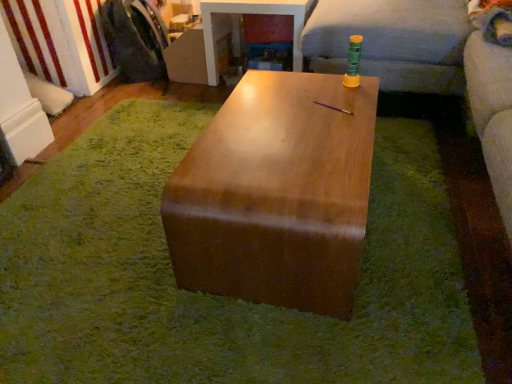
Measure the distance between point (301, 9) and camera.

The depth of point (301, 9) is 2.35 meters.

The height and width of the screenshot is (384, 512). In order to click on soft gray fabric couch at upper right in this screenshot , I will do `click(393, 42)`.

This screenshot has height=384, width=512. Describe the element at coordinates (276, 193) in the screenshot. I see `glossy wood table at center, arranged as the first table when viewed from the front` at that location.

This screenshot has height=384, width=512. Find the location of `wooden table at center`. wooden table at center is located at coordinates (213, 295).

The width and height of the screenshot is (512, 384). I want to click on glossy wood table at center, which is the 2th table from bottom to top, so click(x=252, y=13).

From a real-world perspective, is wooden table at center on glossy wood table at center, which is the 2th table from bottom to top?

No, from a real-world perspective, wooden table at center is not over glossy wood table at center, which is the 2th table from bottom to top

Which is closer, [230,305] or [290,0]?

Point [230,305] is closer to the camera than point [290,0].

Which object is more forward, wooden table at center or glossy wood table at center, which is the 1th table in back-to-front order?

Positioned in front is wooden table at center.

Can you tell me how much wooden table at center and glossy wood table at center, which is the 1th table in back-to-front order, differ in facing direction?

The angular difference between wooden table at center and glossy wood table at center, which is the 1th table in back-to-front order, is 1.66 degrees.

Between glossy wood table at center, which appears as the 1th table when ordered from the bottom, and wooden table at center, which one has more height?

glossy wood table at center, which appears as the 1th table when ordered from the bottom.

Which is behind, point (183, 175) or point (294, 332)?

Positioned behind is point (294, 332).

From a real-world perspective, is glossy wood table at center, arranged as the first table when viewed from the front, physically above wooden table at center?

Indeed, from a real-world perspective, glossy wood table at center, arranged as the first table when viewed from the front, stands above wooden table at center.

In the scene shown: Is soft gray fabric couch at upper right facing away from wooden table at center?

No, wooden table at center is not at the back of soft gray fabric couch at upper right.

From the image's perspective, would you say soft gray fabric couch at upper right is positioned over wooden table at center?

Correct, soft gray fabric couch at upper right appears higher than wooden table at center in the image.

Who is shorter, soft gray fabric couch at upper right or wooden table at center?

wooden table at center is shorter.

Which is more to the right, glossy wood table at center, which is the 2th table from bottom to top, or glossy wood table at center, arranged as the first table when viewed from the front?

From the viewer's perspective, glossy wood table at center, arranged as the first table when viewed from the front, appears more on the right side.

Which is closer, (233, 13) or (228, 236)?

Clearly, point (233, 13) is more distant from the camera than point (228, 236).

Which is correct: glossy wood table at center, which is the 1th table in back-to-front order, is inside glossy wood table at center, the 2th table when ordered from top to bottom, or outside of it?

glossy wood table at center, which is the 1th table in back-to-front order, is not enclosed by glossy wood table at center, the 2th table when ordered from top to bottom.

Considering the sizes of glossy wood table at center, which is the 2th table from bottom to top, and glossy wood table at center, which appears as the 1th table when ordered from the bottom, in the image, is glossy wood table at center, which is the 2th table from bottom to top, bigger or smaller than glossy wood table at center, which appears as the 1th table when ordered from the bottom,?

Clearly, glossy wood table at center, which is the 2th table from bottom to top, is smaller in size than glossy wood table at center, which appears as the 1th table when ordered from the bottom.

Does glossy wood table at center, the 2th table when ordered from top to bottom, turn towards glossy wood table at center, which is the 1th table in back-to-front order?

No, glossy wood table at center, the 2th table when ordered from top to bottom, is not oriented towards glossy wood table at center, which is the 1th table in back-to-front order.

Locate an element on the screen. table that is in front of the glossy wood table at center, which is the 2th table from bottom to top is located at coordinates (276, 193).

From a real-world perspective, does glossy wood table at center, which appears as the 1th table when ordered from the bottom, sit lower than glossy wood table at center, which is the 1th table in back-to-front order?

Yes, from a real-world perspective, glossy wood table at center, which appears as the 1th table when ordered from the bottom, is below glossy wood table at center, which is the 1th table in back-to-front order.

From the image's perspective, relative to glossy wood table at center, arranged as the 2th table when viewed from the front, is glossy wood table at center, the second table viewed from the back, above or below?

glossy wood table at center, the second table viewed from the back, is below glossy wood table at center, arranged as the 2th table when viewed from the front.

Is brushed metal washing machine at left positioned with its back to soft gray fabric couch at upper right?

No, brushed metal washing machine at left is not facing the opposite direction of soft gray fabric couch at upper right.

Is there a large distance between brushed metal washing machine at left and soft gray fabric couch at upper right?

brushed metal washing machine at left is far away from soft gray fabric couch at upper right.

You are a GUI agent. You are given a task and a screenshot of the screen. Output one action in this format:
    pyautogui.click(x=<x>, y=<y>)
    Task: Click on the couple above the soft gray fabric couch at upper right (from the image's perspective)
    This screenshot has height=384, width=512.
    Given the screenshot: What is the action you would take?
    pyautogui.click(x=135, y=38)

How different are the orientations of brushed metal washing machine at left and soft gray fabric couch at upper right in degrees?

There is a 180-degree angle between the facing directions of brushed metal washing machine at left and soft gray fabric couch at upper right.

Measure the distance from soft gray fabric couch at upper right to glossy wood table at center, the first table viewed from the top.

soft gray fabric couch at upper right and glossy wood table at center, the first table viewed from the top, are 16.94 inches apart.

From a real-world perspective, is soft gray fabric couch at upper right physically located above or below glossy wood table at center, which is the 1th table in back-to-front order?

From a real-world perspective, soft gray fabric couch at upper right is physically above glossy wood table at center, which is the 1th table in back-to-front order.

Considering the relative positions of soft gray fabric couch at upper right and glossy wood table at center, arranged as the 2th table when viewed from the front, in the image provided, is soft gray fabric couch at upper right in front of glossy wood table at center, arranged as the 2th table when viewed from the front,?

Yes, soft gray fabric couch at upper right is closer to the viewer.

Considering the relative sizes of soft gray fabric couch at upper right and glossy wood table at center, which is the 2th table from bottom to top, in the image provided, is soft gray fabric couch at upper right thinner than glossy wood table at center, which is the 2th table from bottom to top,?

No, soft gray fabric couch at upper right is not thinner than glossy wood table at center, which is the 2th table from bottom to top.

The image size is (512, 384). Identify the location of the 1st table to the right when counting from the wooden table at center. (252, 13).

The height and width of the screenshot is (384, 512). Identify the location of mat below the glossy wood table at center, arranged as the first table when viewed from the front (from the image's perspective). (213, 295).

Considering their positions, is glossy wood table at center, which is the 2th table from bottom to top, positioned further to brushed metal washing machine at left than glossy wood table at center, the second table viewed from the back?

The object further to brushed metal washing machine at left is glossy wood table at center, the second table viewed from the back.

Looking at the image, which one is located closer to glossy wood table at center, which is the 2th table from bottom to top, soft gray fabric couch at upper right or wooden table at center?

soft gray fabric couch at upper right is positioned closer to the anchor glossy wood table at center, which is the 2th table from bottom to top.

From the image, which object appears to be farther from wooden table at center, brushed metal washing machine at left or soft gray fabric couch at upper right?

The object further to wooden table at center is brushed metal washing machine at left.

Estimate the real-world distances between objects in this image. Which object is further from brushed metal washing machine at left, wooden table at center or soft gray fabric couch at upper right?

wooden table at center.

Considering their positions, is glossy wood table at center, which is the 1th table in back-to-front order, positioned further to glossy wood table at center, the second table viewed from the back, than wooden table at center?

The object further to glossy wood table at center, the second table viewed from the back, is glossy wood table at center, which is the 1th table in back-to-front order.

From the image, which object appears to be nearer to wooden table at center, glossy wood table at center, the second table viewed from the back, or brushed metal washing machine at left?

Among the two, glossy wood table at center, the second table viewed from the back, is located nearer to wooden table at center.

Looking at the image, which one is located further to glossy wood table at center, arranged as the first table when viewed from the front, soft gray fabric couch at upper right or brushed metal washing machine at left?

The object further to glossy wood table at center, arranged as the first table when viewed from the front, is brushed metal washing machine at left.

From the image, which object appears to be farther from glossy wood table at center, arranged as the 2th table when viewed from the front, brushed metal washing machine at left or wooden table at center?

Among the two, wooden table at center is located further to glossy wood table at center, arranged as the 2th table when viewed from the front.

Locate an element on the screen. This screenshot has width=512, height=384. table positioned between glossy wood table at center, which appears as the 1th table when ordered from the bottom, and brushed metal washing machine at left from near to far is located at coordinates (252, 13).

At what (x,y) coordinates should I click in order to perform the action: click on couch positioned between wooden table at center and glossy wood table at center, the first table viewed from the top, from near to far. Please return your answer as a coordinate pair (x, y). Looking at the image, I should click on (393, 42).

Identify the location of mat between brushed metal washing machine at left and soft gray fabric couch at upper right in the horizontal direction. (213, 295).

Where is `couch between glossy wood table at center, the 2th table when ordered from top to bottom, and glossy wood table at center, which is the 2th table from bottom to top, along the z-axis`? The image size is (512, 384). couch between glossy wood table at center, the 2th table when ordered from top to bottom, and glossy wood table at center, which is the 2th table from bottom to top, along the z-axis is located at coordinates (393, 42).